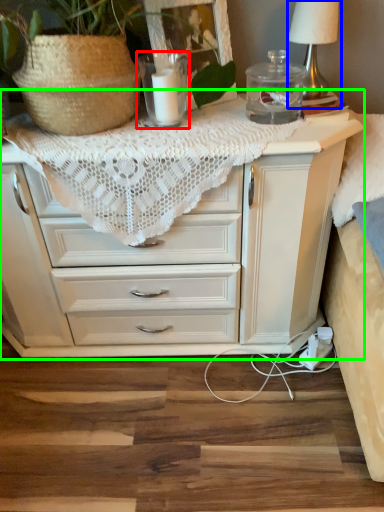
Question: Which object is the closest to the candle holder (highlighted by a red box)? Choose among these: table lamp (highlighted by a blue box) or chest of drawers (highlighted by a green box).

Choices:
 (A) table lamp
 (B) chest of drawers

Answer: (A)